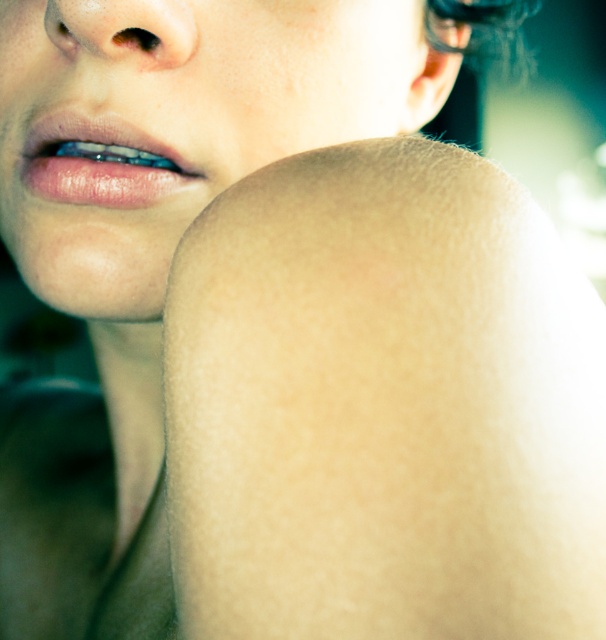
Question: In this image, where is smooth skin at lower left located relative to dark brown hair at upper center?

Choices:
 (A) right
 (B) left

Answer: (B)

Question: Can you confirm if smooth skin at lower left is smaller than dark brown hair at upper center?

Choices:
 (A) yes
 (B) no

Answer: (A)

Question: Can you confirm if smooth skin at lower left is positioned to the left of dark brown hair at upper center?

Choices:
 (A) no
 (B) yes

Answer: (B)

Question: Which point is farther from the camera taking this photo?

Choices:
 (A) (141, 33)
 (B) (296, 44)

Answer: (B)

Question: Which object is farther from the camera taking this photo?

Choices:
 (A) smooth skin at lower left
 (B) dark brown hair at upper center

Answer: (B)

Question: Which point is closer to the camera taking this photo?

Choices:
 (A) (341, 58)
 (B) (478, 13)

Answer: (A)